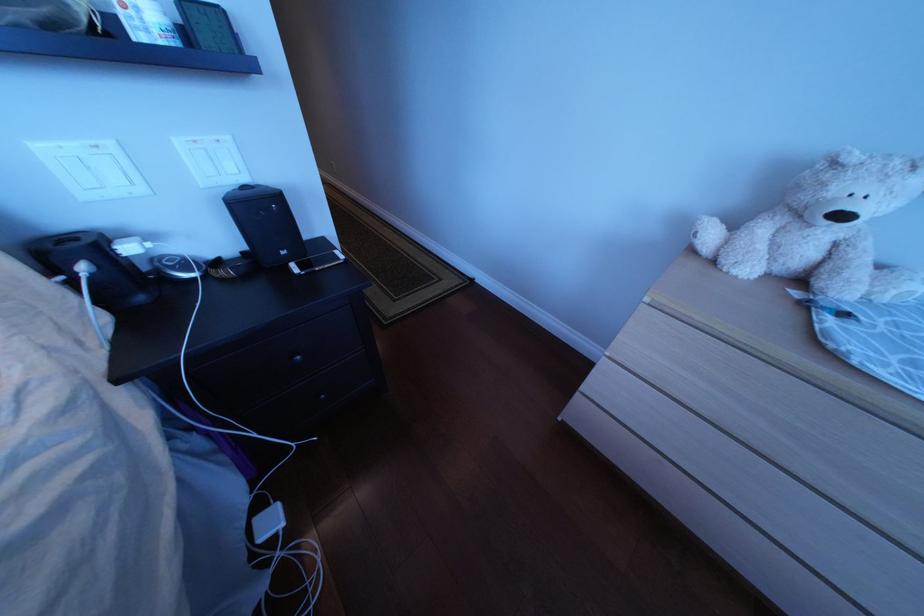
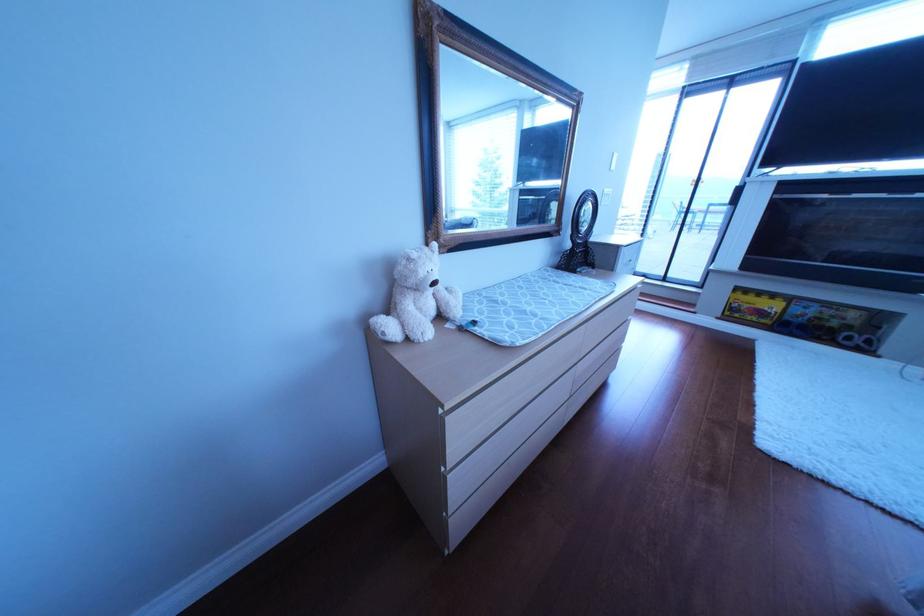
In the scene shown: The images are taken continuously from a first-person perspective. In which direction is your viewpoint rotating?

The camera's rotation is toward right-down.